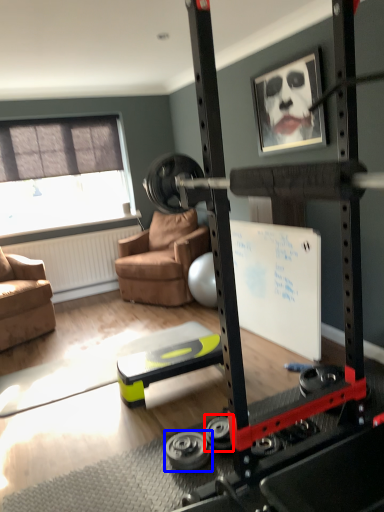
Question: Which object is further to the camera taking this photo, wheel (highlighted by a red box) or wheel (highlighted by a blue box)?

Choices:
 (A) wheel
 (B) wheel

Answer: (A)